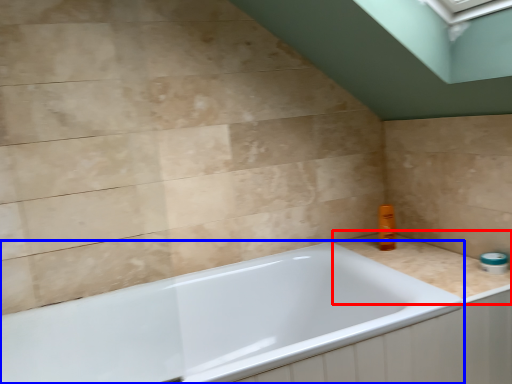
Question: Among these objects, which one is nearest to the camera, counter top (highlighted by a red box) or bathtub (highlighted by a blue box)?

Choices:
 (A) counter top
 (B) bathtub

Answer: (B)